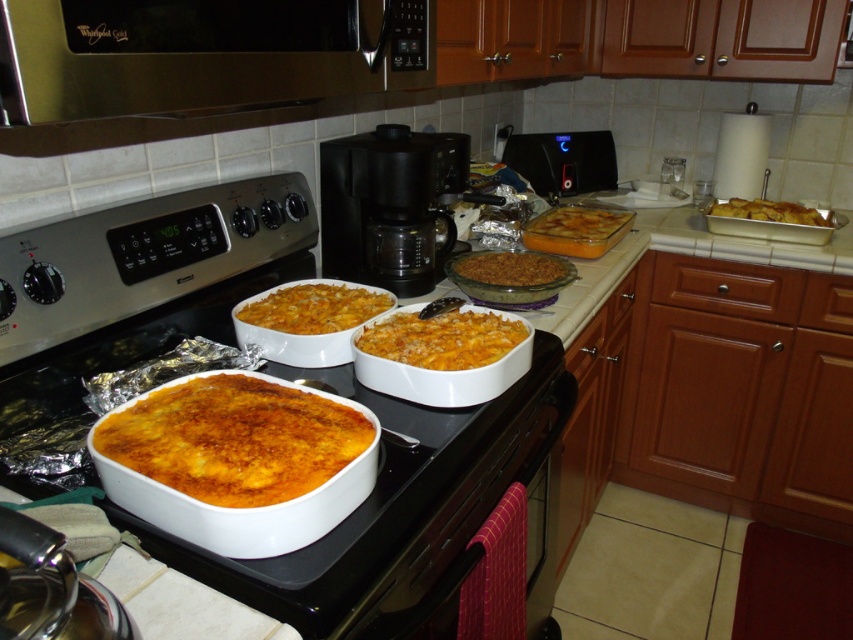
Question: Which of the following is the closest to the observer?

Choices:
 (A) (366, 344)
 (B) (482, 282)

Answer: (A)

Question: Which of the following is the closest to the observer?

Choices:
 (A) golden brown casserole at center
 (B) golden brown baked dish at center

Answer: (B)

Question: Can you confirm if golden brown baked dish at center is bigger than black plastic coffee maker at center?

Choices:
 (A) yes
 (B) no

Answer: (B)

Question: Which object is closer to the camera taking this photo?

Choices:
 (A) golden brown baked dish at upper right
 (B) black plastic toaster oven at upper center

Answer: (A)

Question: Does brushed metal microwave at upper center lie behind black plastic coffee maker at center?

Choices:
 (A) yes
 (B) no

Answer: (B)

Question: Does black plastic toaster oven at upper center appear under golden brown crusty casserole at center?

Choices:
 (A) yes
 (B) no

Answer: (B)